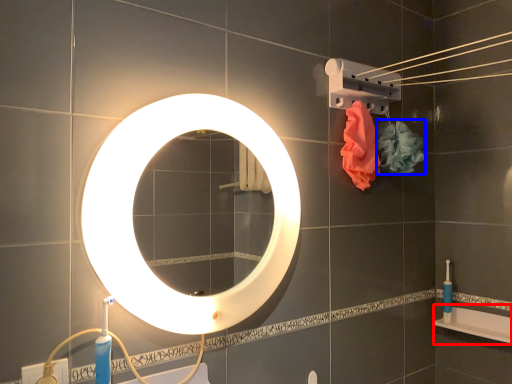
Question: Which object is closer to the camera taking this photo, bath (highlighted by a red box) or flower (highlighted by a blue box)?

Choices:
 (A) bath
 (B) flower

Answer: (B)